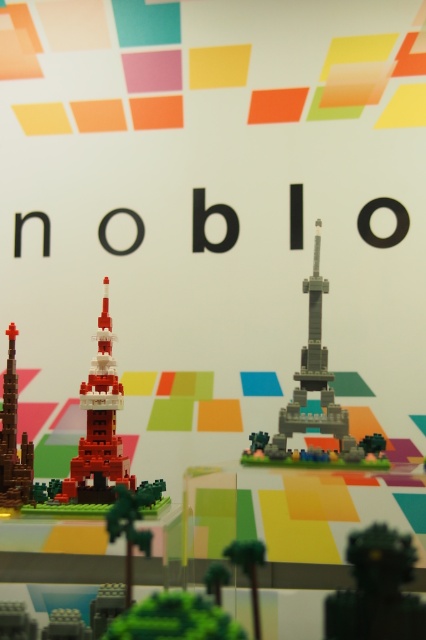
Question: Which object appears farthest from the camera in this image?

Choices:
 (A) brick-like tower at center
 (B) green matte statue at lower right
 (C) gray metallic eiffel tower at center

Answer: (C)

Question: Which of the following is the farthest from the observer?

Choices:
 (A) brick-like tower at center
 (B) gray matte tower at center
 (C) brick-like tower at left

Answer: (B)

Question: Can you confirm if green matte statue at lower right is thinner than brick-like tower at left?

Choices:
 (A) yes
 (B) no

Answer: (B)

Question: Does green matte statue at lower right lie behind brick-like tower at center?

Choices:
 (A) no
 (B) yes

Answer: (A)

Question: In this image, where is gray matte tower at center located relative to gray metallic eiffel tower at center?

Choices:
 (A) right
 (B) left

Answer: (A)

Question: Estimate the real-world distances between objects in this image. Which object is farther from the green matte statue at lower right?

Choices:
 (A) brick-like tower at center
 (B) brick-like tower at left
 (C) gray matte tower at center
 (D) gray metallic eiffel tower at center

Answer: (B)